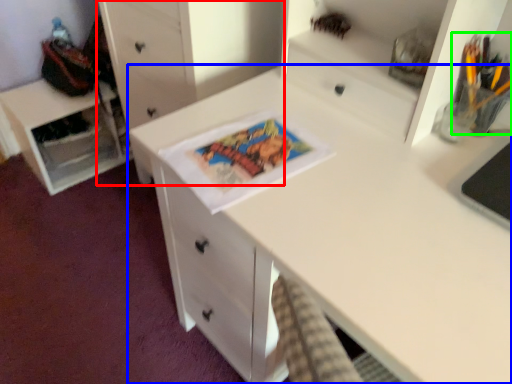
Question: Which object is the closest to the chest of drawers (highlighted by a red box)? Choose among these: desk (highlighted by a blue box) or stationery (highlighted by a green box).

Choices:
 (A) desk
 (B) stationery

Answer: (A)